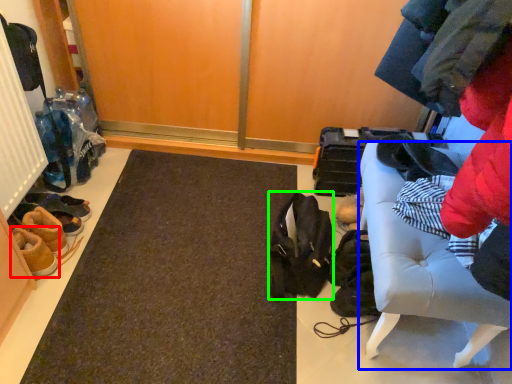
Question: Considering the real-world distances, which object is closest to footwear (highlighted by a red box)? furniture (highlighted by a blue box) or shoulder bag (highlighted by a green box).

Choices:
 (A) furniture
 (B) shoulder bag

Answer: (B)